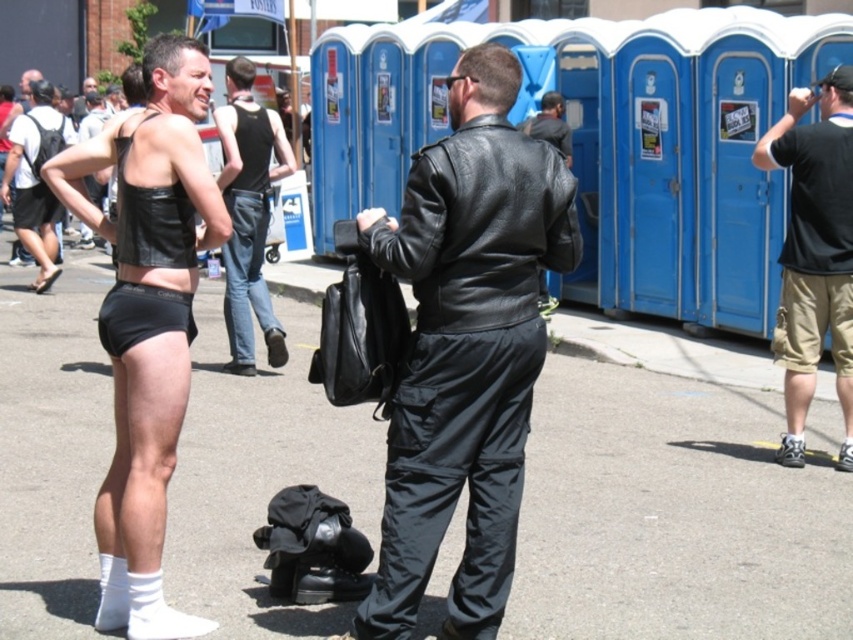
Question: Estimate the real-world distances between objects in this image. Which object is farther from the black matte underwear at center?

Choices:
 (A) leather tank top at center
 (B) black cotton shorts at right

Answer: (B)

Question: Considering the real-world distances, which object is farthest from the leather tank top at center?

Choices:
 (A) black cotton shorts at right
 (B) leather-like black bikini top at left
 (C) black matte underwear at center
 (D) matte black leather shorts at left

Answer: (D)

Question: Does leather-like black bikini top at left have a larger size compared to matte black leather shorts at left?

Choices:
 (A) yes
 (B) no

Answer: (B)

Question: Which point appears farthest from the camera in this image?

Choices:
 (A) (405, 556)
 (B) (270, 340)
 (C) (764, 161)

Answer: (B)

Question: Can you confirm if black leather jacket at center is positioned below black matte underwear at center?

Choices:
 (A) yes
 (B) no

Answer: (A)

Question: Can you confirm if black cotton shorts at right is positioned to the right of leather tank top at center?

Choices:
 (A) no
 (B) yes

Answer: (B)